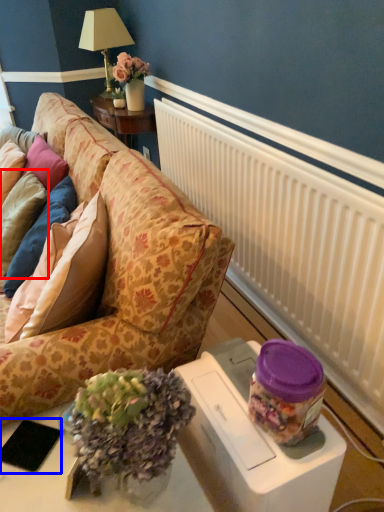
Question: Which object appears closest to the camera in this image, pillow (highlighted by a red box) or pad (highlighted by a blue box)?

Choices:
 (A) pillow
 (B) pad

Answer: (B)